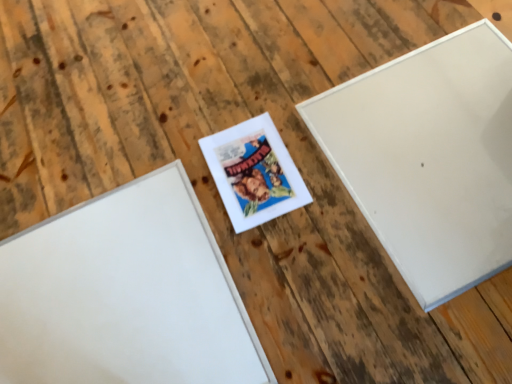
Where is `vacant area to the right of white matte picture frame at center, positioned as the 3th picture frame in right-to-left order`? vacant area to the right of white matte picture frame at center, positioned as the 3th picture frame in right-to-left order is located at coordinates (314, 227).